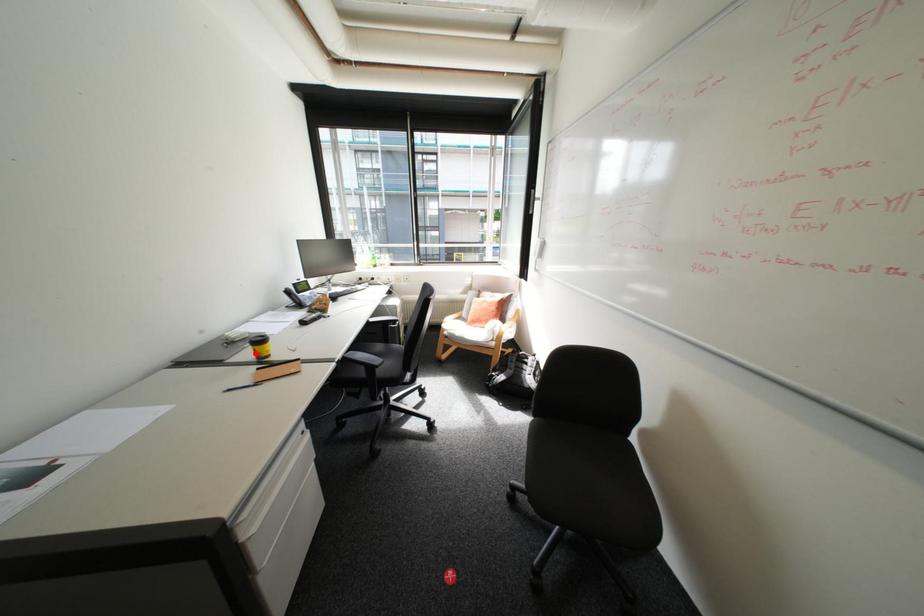
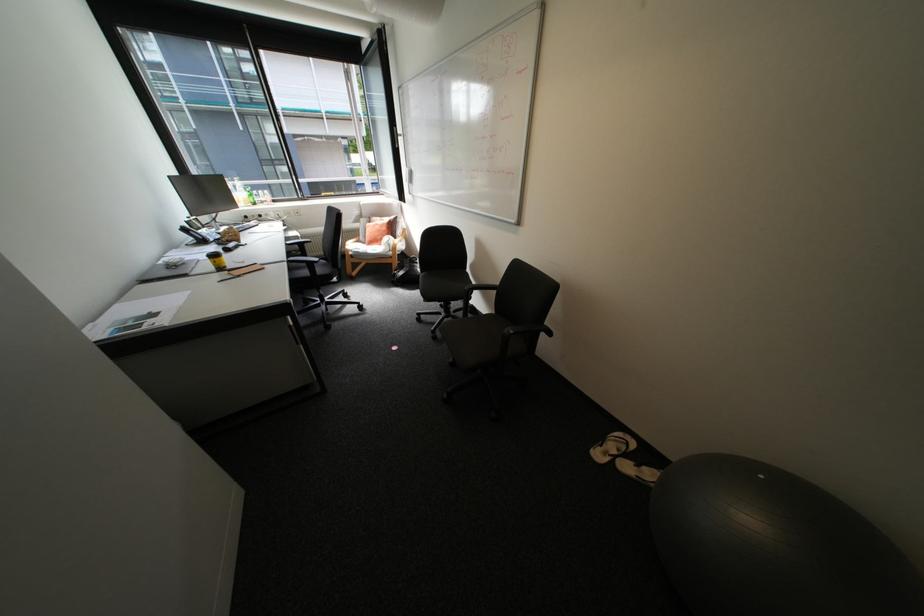
Find the pixel in the second image that matches the highlighted location in the first image.

(217, 265)